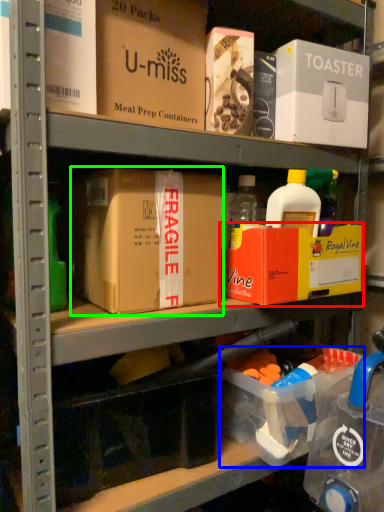
Question: Based on their relative distances, which object is nearer to box (highlighted by a red box)? Choose from storage box (highlighted by a blue box) and box (highlighted by a green box).

Choices:
 (A) storage box
 (B) box

Answer: (B)